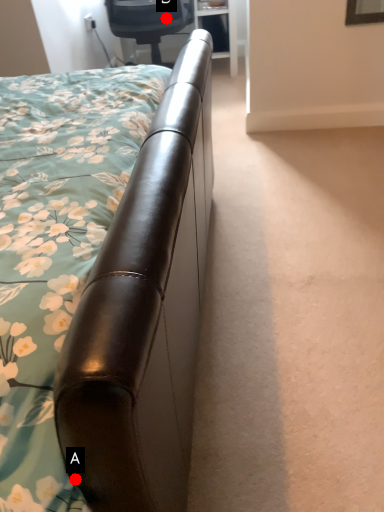
Question: Two points are circled on the image, labeled by A and B beside each circle. Which point appears closest to the camera in this image?

Choices:
 (A) A is closer
 (B) B is closer

Answer: (A)